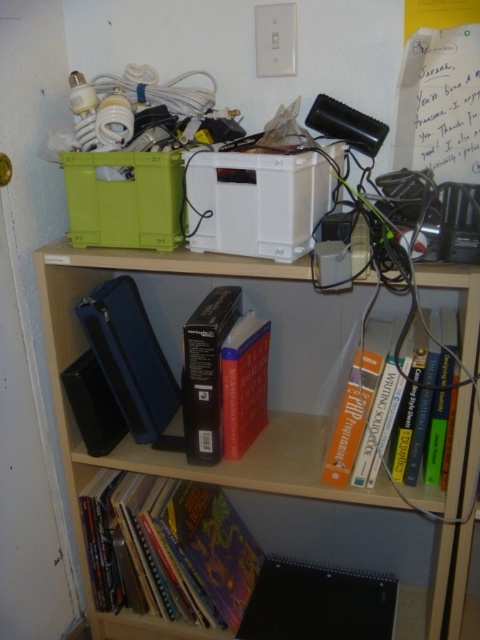
You are organizing the shelf and need to place a new item at position coordinates 0.6, 0.75. Is there enough space between the hardcover book at center and the edge of the shelf to place it there?

The hardcover book at center is located at point (365, 412), so placing an item at (360, 384) would be near it but the exact space availability depends on the shelf dimensions and other items not specified. However, based on the given coordinates, the new position is close but not overlapping, so it might fit if there is no obstruction.

You are organizing the bottom shelf of the cluttered shelf unit. You have two books to place there, the hardcover book at center and the red matte book at center. Since the shelf has limited vertical space, which book should you place first to ensure both fit vertically?

The hardcover book at center is taller than the red matte book at center, so you should place the hardcover book at center first to accommodate its height, then the red matte book at center on top or below depending on space availability.